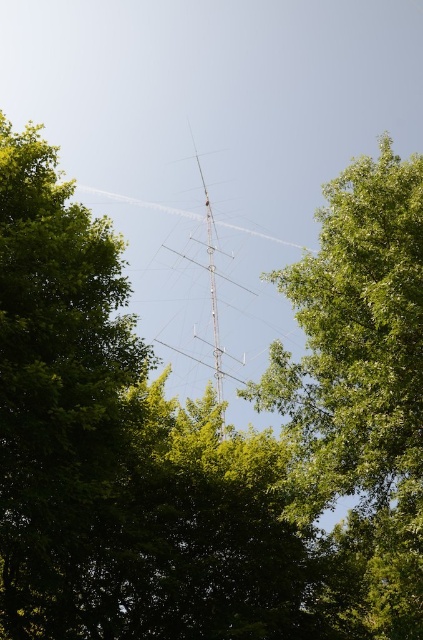
Does point (364, 209) come closer to viewer compared to point (195, 157)?

Yes, it is.

Is point (326, 356) farther from viewer compared to point (213, 220)?

No, it is in front of (213, 220).

Between point (326, 400) and point (209, 234), which one is positioned behind?

The point (209, 234) is behind.

Find the location of a particular element. This screenshot has height=640, width=423. green leafy tree at center is located at coordinates (359, 388).